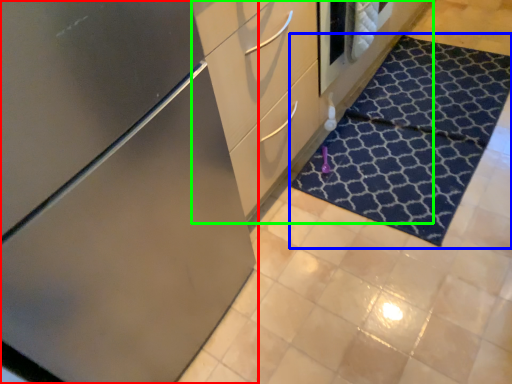
Question: Estimate the real-world distances between objects in this image. Which object is farther from cabinetry (highlighted by a red box), doormat (highlighted by a blue box) or dresser (highlighted by a green box)?

Choices:
 (A) doormat
 (B) dresser

Answer: (A)